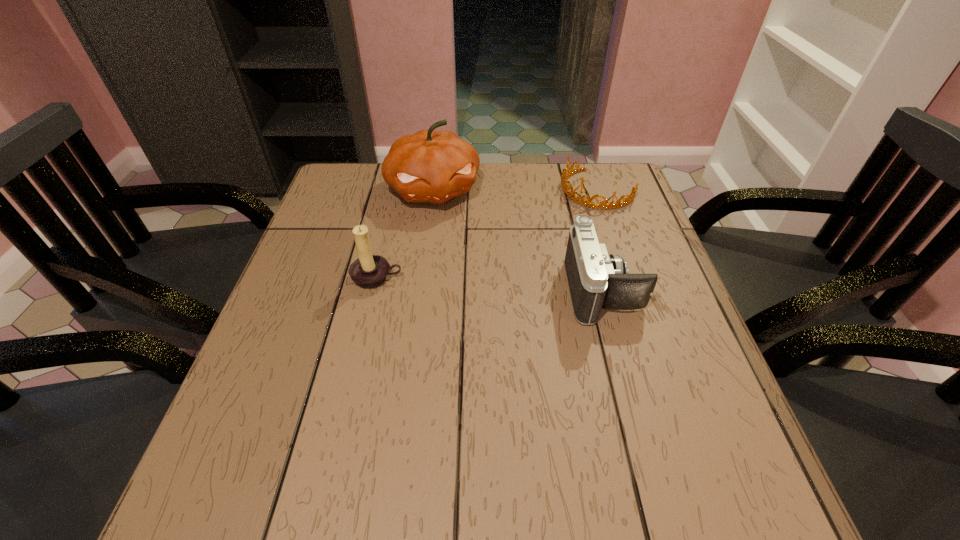
In the image, there is a desktop. What are the coordinates of `vacant space at the right edge` in the screenshot? It's located at (627, 225).

This screenshot has height=540, width=960. Identify the location of vacant space at the far left corner of the desktop. [348, 200].

In the image, there is a desktop. Where is `vacant space at the far right corner`? The height and width of the screenshot is (540, 960). vacant space at the far right corner is located at coordinates (621, 176).

You are a GUI agent. You are given a task and a screenshot of the screen. Output one action in this format:
    pyautogui.click(x=<x>, y=<y>)
    Task: Click on the blank area at the near right corner
    The image size is (960, 540).
    Given the screenshot: What is the action you would take?
    pyautogui.click(x=676, y=427)

Image resolution: width=960 pixels, height=540 pixels. Identify the location of vacant area that lies between the candle holder and the tallest object. (405, 234).

I want to click on free space between the shortest object and the candle holder, so click(487, 233).

In order to click on empty space that is in between the candle holder and the shortest object in this screenshot , I will do [x=487, y=233].

The image size is (960, 540). I want to click on free space that is in between the tallest object and the shortest object, so click(x=516, y=190).

The height and width of the screenshot is (540, 960). I want to click on free space between the pumpkin and the camera, so click(518, 240).

The image size is (960, 540). In order to click on empty location between the tallest object and the candle holder in this screenshot , I will do `click(405, 234)`.